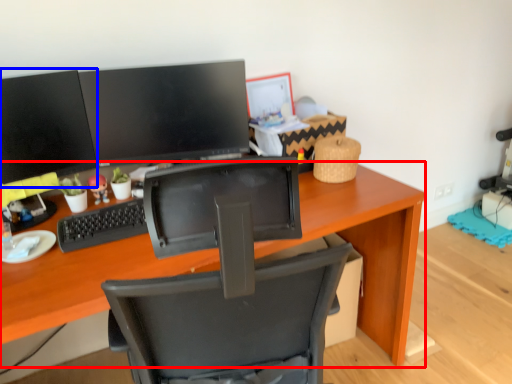
Question: Which point is further to the camera, desk (highlighted by a red box) or computer monitor (highlighted by a blue box)?

Choices:
 (A) desk
 (B) computer monitor

Answer: (B)